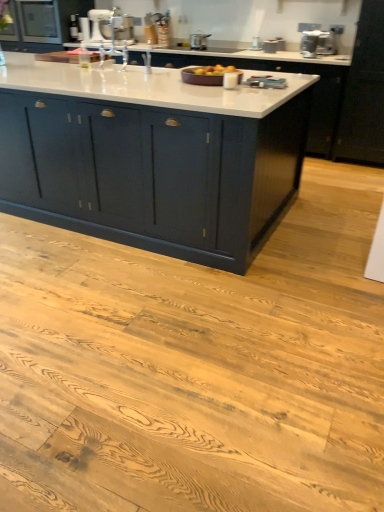
Describe the element at coordinates (41, 24) in the screenshot. I see `matte black cabinet at upper left, arranged as the first cabinetry when viewed from the back` at that location.

In the scene shown: Measure the distance between satin silver toaster at upper right, which is the fifth appliance in left-to-right order, and camera.

They are 4.16 meters apart.

Measure the distance between point (304, 34) and camera.

Point (304, 34) and camera are 14.27 feet apart from each other.

In order to face metallic silver toaster at upper right, marked as the 2th appliance in a right-to-left arrangement, should I rotate leftwards or rightwards?

It's best to rotate right around 15.582 degrees.

Where is `matte dark blue cabinet at center, placed as the second cabinetry when sorted from top to bottom`? The image size is (384, 512). matte dark blue cabinet at center, placed as the second cabinetry when sorted from top to bottom is located at coordinates (151, 157).

Measure the distance between point (202, 41) and camera.

They are 4.62 meters apart.

Measure the distance between satin silver pot at upper center, which is the third appliance from back to front, and camera.

satin silver pot at upper center, which is the third appliance from back to front, and camera are 4.48 meters apart.

What is the approximate height of metallic silver toaster at upper center, the third appliance positioned from the left?

metallic silver toaster at upper center, the third appliance positioned from the left, is 5.35 inches tall.

You are a GUI agent. You are given a task and a screenshot of the screen. Output one action in this format:
    pyautogui.click(x=<x>, y=<y>)
    Task: Click on the matte black cabinet at upper left, arranged as the first cabinetry when viewed from the back
    This screenshot has height=512, width=384.
    Given the screenshot: What is the action you would take?
    pyautogui.click(x=41, y=24)

How far apart are white glossy stand mixer at upper center, which ranks as the 5th appliance in front-to-back order, and metallic silver toaster at upper center, which ranks as the 4th appliance in front-to-back order?

white glossy stand mixer at upper center, which ranks as the 5th appliance in front-to-back order, and metallic silver toaster at upper center, which ranks as the 4th appliance in front-to-back order, are 5.91 feet apart.

Considering the positions of point (99, 23) and point (280, 42), is point (99, 23) closer or farther from the camera than point (280, 42)?

Point (99, 23) is positioned farther from the camera compared to point (280, 42).

From the image's perspective, between white glossy stand mixer at upper center, which ranks as the 5th appliance in front-to-back order, and metallic silver toaster at upper center, the 2th appliance in the back-to-front sequence, which one is located above?

white glossy stand mixer at upper center, which ranks as the 5th appliance in front-to-back order.

Looking at this image, is white glossy stand mixer at upper center, which ranks as the 5th appliance in front-to-back order, in front of or behind metallic silver toaster at upper center, which ranks as the 4th appliance in front-to-back order, in the image?

Visually, white glossy stand mixer at upper center, which ranks as the 5th appliance in front-to-back order, is located behind metallic silver toaster at upper center, which ranks as the 4th appliance in front-to-back order.

Is white glossy stand mixer at upper center, positioned as the 1th appliance in left-to-right order, at the back of satin silver pot at upper center, positioned as the 2th appliance in left-to-right order?

satin silver pot at upper center, positioned as the 2th appliance in left-to-right order, does not have its back to white glossy stand mixer at upper center, positioned as the 1th appliance in left-to-right order.

Is white glossy stand mixer at upper center, positioned as the 1th appliance in left-to-right order, inside satin silver pot at upper center, positioned as the 2th appliance in left-to-right order?

No, white glossy stand mixer at upper center, positioned as the 1th appliance in left-to-right order, is located outside of satin silver pot at upper center, positioned as the 2th appliance in left-to-right order.

From a real-world perspective, is satin silver pot at upper center, the 4th appliance from the right, above or below white glossy stand mixer at upper center, which ranks as the fifth appliance in right-to-left order?

satin silver pot at upper center, the 4th appliance from the right, is below white glossy stand mixer at upper center, which ranks as the fifth appliance in right-to-left order.

Considering the positions of points (125, 57) and (100, 38), is point (125, 57) closer to camera compared to point (100, 38)?

Yes.

Considering the sizes of white glossy sink at upper center and white glossy stand mixer at upper center, which ranks as the 5th appliance in front-to-back order, in the image, is white glossy sink at upper center wider or thinner than white glossy stand mixer at upper center, which ranks as the 5th appliance in front-to-back order,?

In the image, white glossy sink at upper center appears to be wider than white glossy stand mixer at upper center, which ranks as the 5th appliance in front-to-back order.

From a real-world perspective, which is physically below, white glossy sink at upper center or white glossy stand mixer at upper center, which ranks as the 5th appliance in front-to-back order?

white glossy sink at upper center.

Who is shorter, white glossy sink at upper center or white glossy stand mixer at upper center, the first appliance when ordered from back to front?

white glossy stand mixer at upper center, the first appliance when ordered from back to front, is shorter.

From the image's perspective, which one is positioned higher, white glossy stand mixer at upper center, which ranks as the 5th appliance in front-to-back order, or white glossy sink at upper center?

white glossy stand mixer at upper center, which ranks as the 5th appliance in front-to-back order, is shown above in the image.

Choose the correct answer: Is white glossy stand mixer at upper center, which ranks as the fifth appliance in right-to-left order, inside white glossy sink at upper center or outside it?

white glossy stand mixer at upper center, which ranks as the fifth appliance in right-to-left order, cannot be found inside white glossy sink at upper center.

Is white glossy sink at upper center at the back of white glossy stand mixer at upper center, the first appliance when ordered from back to front?

No, white glossy stand mixer at upper center, the first appliance when ordered from back to front, is not facing away from white glossy sink at upper center.

Considering the relative sizes of metallic silver toaster at upper center, which ranks as the 4th appliance in front-to-back order, and metallic silver toaster at upper right, acting as the first appliance starting from the front, in the image provided, is metallic silver toaster at upper center, which ranks as the 4th appliance in front-to-back order, shorter than metallic silver toaster at upper right, acting as the first appliance starting from the front,?

Indeed, metallic silver toaster at upper center, which ranks as the 4th appliance in front-to-back order, has a lesser height compared to metallic silver toaster at upper right, acting as the first appliance starting from the front.

Is metallic silver toaster at upper center, the 2th appliance in the back-to-front sequence, in contact with metallic silver toaster at upper right, the fifth appliance from the back?

They are not placed beside each other.

What's the angular difference between white glossy stand mixer at upper center, positioned as the 1th appliance in left-to-right order, and satin silver pot at upper center, which is the third appliance from back to front,'s facing directions?

They differ by 18.6 degrees in their facing directions.

Looking at this image, considering the sizes of objects white glossy stand mixer at upper center, positioned as the 1th appliance in left-to-right order, and satin silver pot at upper center, positioned as the 2th appliance in left-to-right order, in the image provided, who is taller, white glossy stand mixer at upper center, positioned as the 1th appliance in left-to-right order, or satin silver pot at upper center, positioned as the 2th appliance in left-to-right order,?

white glossy stand mixer at upper center, positioned as the 1th appliance in left-to-right order, is taller.

Considering the sizes of white glossy stand mixer at upper center, which ranks as the fifth appliance in right-to-left order, and satin silver pot at upper center, the 4th appliance from the right, in the image, is white glossy stand mixer at upper center, which ranks as the fifth appliance in right-to-left order, wider or thinner than satin silver pot at upper center, the 4th appliance from the right,?

Considering their sizes, white glossy stand mixer at upper center, which ranks as the fifth appliance in right-to-left order, looks slimmer than satin silver pot at upper center, the 4th appliance from the right.

Which is further, (89, 12) or (205, 34)?

Point (89, 12)

Is point (72, 131) farther from camera compared to point (199, 41)?

No.

From the picture: Looking at the image, does matte dark blue cabinet at center, the 1th cabinetry positioned from the bottom, seem bigger or smaller compared to satin silver pot at upper center, the 4th appliance from the right?

matte dark blue cabinet at center, the 1th cabinetry positioned from the bottom, is bigger than satin silver pot at upper center, the 4th appliance from the right.

Is matte dark blue cabinet at center, which is the second cabinetry in back-to-front order, wider than satin silver pot at upper center, positioned as the 2th appliance in left-to-right order?

Indeed, matte dark blue cabinet at center, which is the second cabinetry in back-to-front order, has a greater width compared to satin silver pot at upper center, positioned as the 2th appliance in left-to-right order.

From the image's perspective, would you say matte dark blue cabinet at center, placed as the second cabinetry when sorted from top to bottom, is shown under satin silver pot at upper center, which is counted as the 3th appliance, starting from the front?

Yes, from the image's perspective, matte dark blue cabinet at center, placed as the second cabinetry when sorted from top to bottom, is below satin silver pot at upper center, which is counted as the 3th appliance, starting from the front.

The height and width of the screenshot is (512, 384). Identify the location of appliance behind the metallic silver toaster at upper center, the 3th appliance from the right. (98, 24).

Identify the location of appliance lying on the left of satin silver pot at upper center, which is the third appliance from back to front. (98, 24).

From the picture: Looking at the image, which one is located closer to metallic silver toaster at upper right, the fifth appliance from the back, satin silver pot at upper center, positioned as the 2th appliance in left-to-right order, or metallic silver toaster at upper center, the 2th appliance in the back-to-front sequence?

metallic silver toaster at upper center, the 2th appliance in the back-to-front sequence.

Estimate the real-world distances between objects in this image. Which object is closer to matte black cabinet at upper left, arranged as the first cabinetry when viewed from the back, matte dark blue cabinet at center, which is the second cabinetry in back-to-front order, or metallic silver toaster at upper center, the 3th appliance from the right?

metallic silver toaster at upper center, the 3th appliance from the right.

From the picture: Estimate the real-world distances between objects in this image. Which object is further from metallic silver toaster at upper right, acting as the first appliance starting from the front, matte dark blue cabinet at center, which is the second cabinetry in back-to-front order, or white glossy sink at upper center?

Among the two, matte dark blue cabinet at center, which is the second cabinetry in back-to-front order, is located further to metallic silver toaster at upper right, acting as the first appliance starting from the front.

From the image, which object appears to be farther from satin silver toaster at upper right, which is the fifth appliance in left-to-right order, matte black cabinet at upper left, arranged as the first cabinetry when viewed from the back, or white glossy stand mixer at upper center, positioned as the 1th appliance in left-to-right order?

matte black cabinet at upper left, arranged as the first cabinetry when viewed from the back, is further to satin silver toaster at upper right, which is the fifth appliance in left-to-right order.

From the image, which object appears to be nearer to white glossy stand mixer at upper center, positioned as the 1th appliance in left-to-right order, satin silver toaster at upper right, arranged as the first appliance when viewed from the right, or satin silver pot at upper center, the 4th appliance from the right?

The object closer to white glossy stand mixer at upper center, positioned as the 1th appliance in left-to-right order, is satin silver pot at upper center, the 4th appliance from the right.

Considering their positions, is metallic silver toaster at upper center, the 2th appliance in the back-to-front sequence, positioned closer to white glossy stand mixer at upper center, which ranks as the fifth appliance in right-to-left order, than metallic silver toaster at upper right, acting as the first appliance starting from the front?

Among the two, metallic silver toaster at upper center, the 2th appliance in the back-to-front sequence, is located nearer to white glossy stand mixer at upper center, which ranks as the fifth appliance in right-to-left order.

Estimate the real-world distances between objects in this image. Which object is further from white glossy stand mixer at upper center, which ranks as the 5th appliance in front-to-back order, metallic silver toaster at upper center, the 2th appliance in the back-to-front sequence, or matte black cabinet at upper left, marked as the 1th cabinetry in a top-to-bottom arrangement?

metallic silver toaster at upper center, the 2th appliance in the back-to-front sequence, is positioned further to the anchor white glossy stand mixer at upper center, which ranks as the 5th appliance in front-to-back order.

From the image, which object appears to be nearer to metallic silver toaster at upper center, the 2th appliance in the back-to-front sequence, matte black cabinet at upper left, the 2th cabinetry positioned from the bottom, or white glossy sink at upper center?

white glossy sink at upper center is positioned closer to the anchor metallic silver toaster at upper center, the 2th appliance in the back-to-front sequence.

At what (x,y) coordinates should I click in order to perform the action: click on sink located between white glossy stand mixer at upper center, which ranks as the fifth appliance in right-to-left order, and metallic silver toaster at upper right, marked as the 2th appliance in a right-to-left arrangement, in the left-right direction. Please return your answer as a coordinate pair (x, y). The width and height of the screenshot is (384, 512). Looking at the image, I should click on (100, 41).

Where is `sink located between matte dark blue cabinet at center, which is the second cabinetry in back-to-front order, and white glossy stand mixer at upper center, which ranks as the fifth appliance in right-to-left order, in the depth direction`? The width and height of the screenshot is (384, 512). sink located between matte dark blue cabinet at center, which is the second cabinetry in back-to-front order, and white glossy stand mixer at upper center, which ranks as the fifth appliance in right-to-left order, in the depth direction is located at coordinates (100, 41).

Image resolution: width=384 pixels, height=512 pixels. Identify the location of sink located between matte black cabinet at upper left, marked as the 2th cabinetry in a front-to-back arrangement, and metallic silver toaster at upper center, the third appliance positioned from the left, in the left-right direction. (100, 41).

Image resolution: width=384 pixels, height=512 pixels. In order to click on cabinetry between matte black cabinet at upper left, marked as the 2th cabinetry in a front-to-back arrangement, and metallic silver toaster at upper right, acting as the first appliance starting from the front, from left to right in this screenshot , I will do `click(151, 157)`.